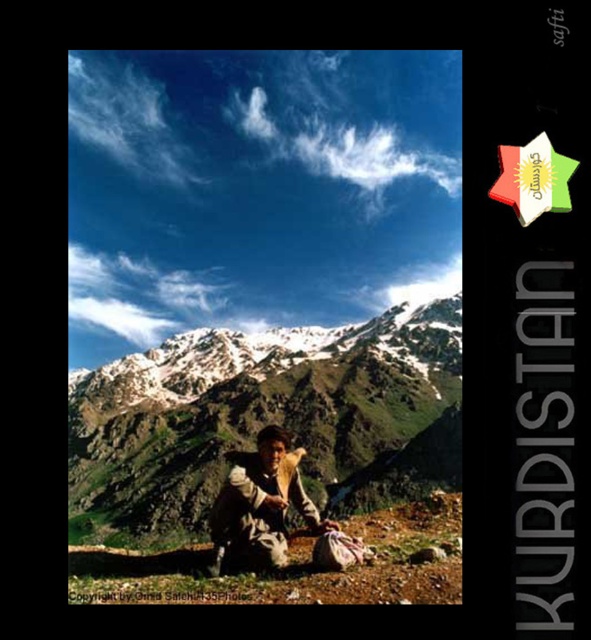
You are planning a hiking trip and see the snowy rock mountain at center and the brown woolen jacket at center in the image. Which object would require more time to climb or move past?

The snowy rock mountain at center is much taller than the brown woolen jacket at center, so it would require more time to climb or move past.

What is the location of the point labeled with coordinates (267, 419) in the image?

The point labeled with coordinates (267, 419) is located on the snowy rock mountain at center.

You are a hiker planning to take a photo of the snowy rock mountain at center and the brown woolen jacket at center. Which object should you focus on first to ensure both are in the frame?

You should focus on the snowy rock mountain at center first because it is closer to the viewer than the brown woolen jacket at center, ensuring both remain in the frame when adjusting the camera.